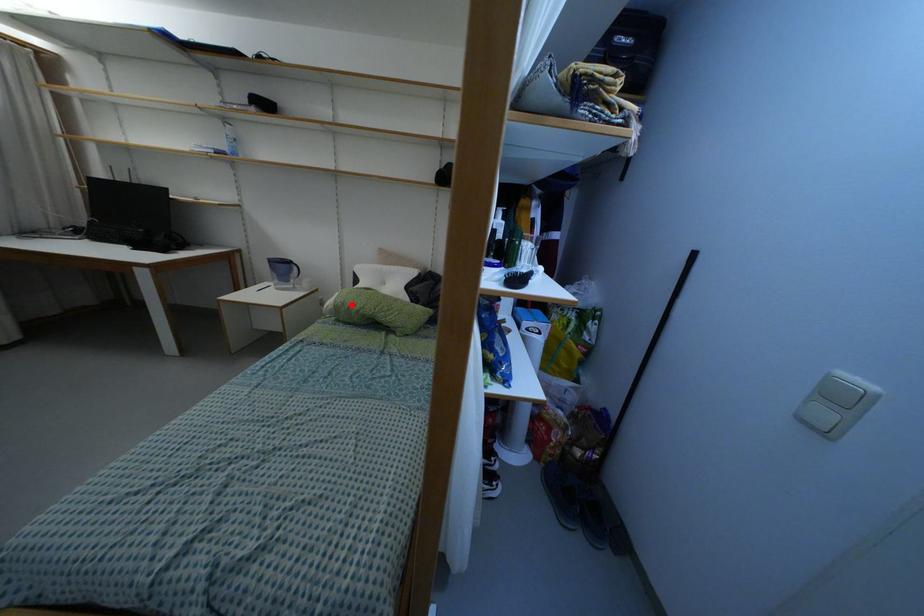
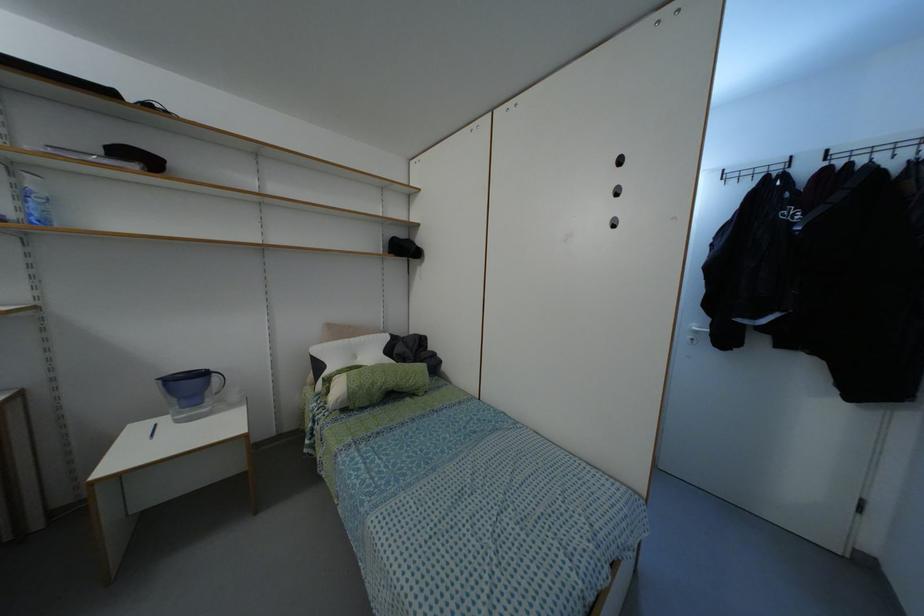
In the second image, find the point that corresponds to the highlighted location in the first image.

(371, 384)